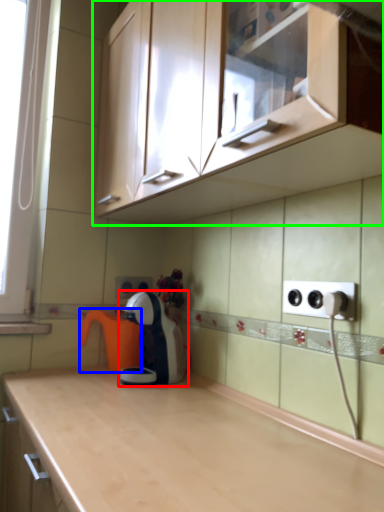
Question: Considering the real-world distances, which object is closest to home appliance (highlighted by a red box)? coffeepot (highlighted by a blue box) or cabinetry (highlighted by a green box).

Choices:
 (A) coffeepot
 (B) cabinetry

Answer: (A)